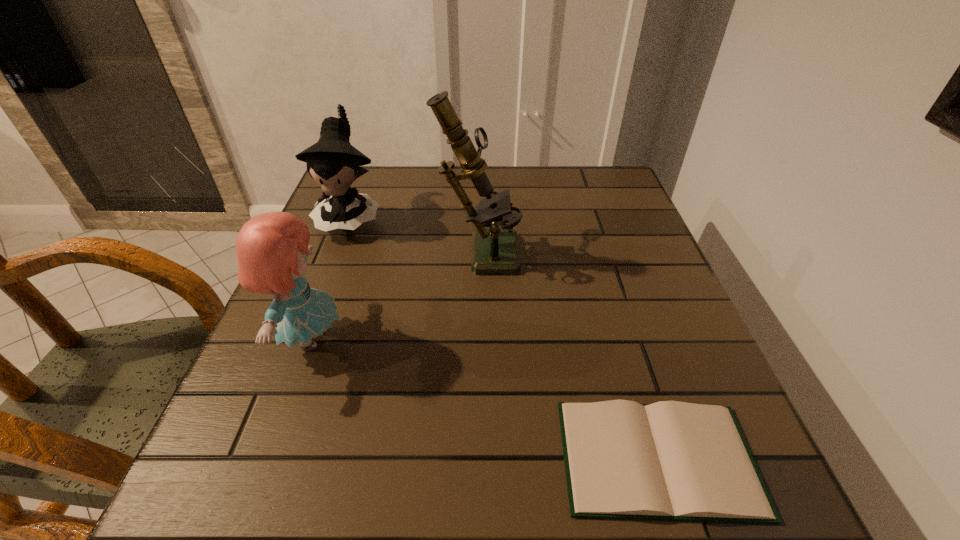
Where is `object present at the far edge`? object present at the far edge is located at coordinates (333, 162).

This screenshot has height=540, width=960. Find the location of `object that is positioned at the near edge`. object that is positioned at the near edge is located at coordinates (676, 461).

The image size is (960, 540). What are the coordinates of `object that is at the right edge` in the screenshot? It's located at (676, 461).

Where is `object situated at the far left corner`? object situated at the far left corner is located at coordinates (333, 162).

At what (x,y) coordinates should I click in order to perform the action: click on object present at the near right corner. Please return your answer as a coordinate pair (x, y). Looking at the image, I should click on (676, 461).

Find the location of a particular element. free space at the far edge of the desktop is located at coordinates (516, 193).

You are a GUI agent. You are given a task and a screenshot of the screen. Output one action in this format:
    pyautogui.click(x=<x>, y=<y>)
    Task: Click on the free space at the near edge of the desktop
    The image size is (960, 540).
    Given the screenshot: What is the action you would take?
    pyautogui.click(x=545, y=484)

This screenshot has height=540, width=960. Identify the location of free space at the left edge of the desktop. (328, 293).

Where is `free location at the right edge of the desktop`? The width and height of the screenshot is (960, 540). free location at the right edge of the desktop is located at coordinates click(630, 301).

You are a GUI agent. You are given a task and a screenshot of the screen. Output one action in this format:
    pyautogui.click(x=<x>, y=<y>)
    Task: Click on the free location at the far left corner
    This screenshot has width=960, height=540.
    Given the screenshot: What is the action you would take?
    tap(360, 192)